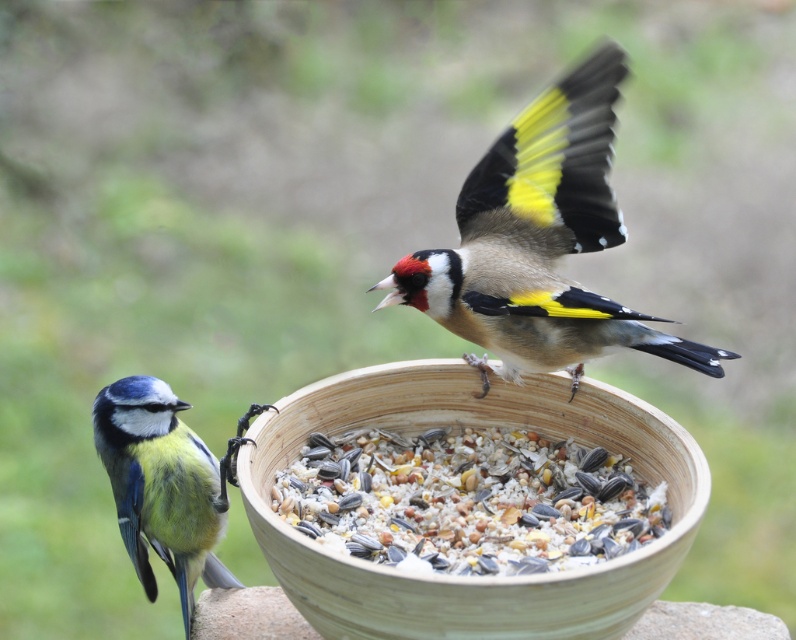
Does yellow-black feathers bird at upper right appear under multicolored seeds at center?

No.

Describe the element at coordinates (540, 241) in the screenshot. I see `yellow-black feathers bird at upper right` at that location.

What are the coordinates of `yellow-black feathers bird at upper right` in the screenshot? It's located at (540, 241).

Can you confirm if wooden bowl at center is positioned to the right of blue-green feathers at lower left?

Indeed, wooden bowl at center is positioned on the right side of blue-green feathers at lower left.

Who is more forward, (385, 365) or (199, 516)?

Point (385, 365) is more forward.

The height and width of the screenshot is (640, 796). I want to click on wooden bowl at center, so click(463, 579).

Which is more to the left, yellow-black feathers bird at upper right or blue-green feathers at lower left?

blue-green feathers at lower left

Locate an element on the screen. The height and width of the screenshot is (640, 796). yellow-black feathers bird at upper right is located at coordinates (540, 241).